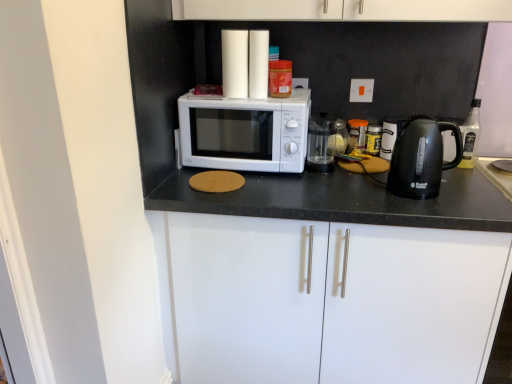
Question: Can you confirm if white matte microwave at center is shorter than white matte cabinet at center, which is the 1th cabinetry from bottom to top?

Choices:
 (A) yes
 (B) no

Answer: (A)

Question: Can you confirm if white matte microwave at center is smaller than white matte cabinet at center, which is the second cabinetry from top to bottom?

Choices:
 (A) yes
 (B) no

Answer: (A)

Question: Is white matte microwave at center positioned with its back to white matte cabinet at center, which is the second cabinetry from top to bottom?

Choices:
 (A) yes
 (B) no

Answer: (B)

Question: Considering the relative sizes of white matte microwave at center and white matte cabinet at center, which is the 1th cabinetry from bottom to top, in the image provided, is white matte microwave at center bigger than white matte cabinet at center, which is the 1th cabinetry from bottom to top,?

Choices:
 (A) yes
 (B) no

Answer: (B)

Question: Is white matte microwave at center positioned behind white matte cabinet at center, which is the 1th cabinetry from bottom to top?

Choices:
 (A) no
 (B) yes

Answer: (B)

Question: Visually, is white matte cabinet doors at upper center, positioned as the first cabinetry in top-to-bottom order, positioned to the left or to the right of black plastic bottle at right?

Choices:
 (A) left
 (B) right

Answer: (A)

Question: In the image, is white matte cabinet doors at upper center, positioned as the first cabinetry in top-to-bottom order, positioned in front of or behind black plastic bottle at right?

Choices:
 (A) front
 (B) behind

Answer: (A)

Question: In terms of width, does white matte cabinet doors at upper center, positioned as the first cabinetry in top-to-bottom order, look wider or thinner when compared to black plastic bottle at right?

Choices:
 (A) wide
 (B) thin

Answer: (A)

Question: Does point (476, 13) appear closer or farther from the camera than point (473, 137)?

Choices:
 (A) farther
 (B) closer

Answer: (B)

Question: From the image's perspective, is white matte cabinet at center, which is the 1th cabinetry from bottom to top, above or below transparent glass coffee maker at center?

Choices:
 (A) above
 (B) below

Answer: (B)

Question: Considering the positions of white matte cabinet at center, which is the 1th cabinetry from bottom to top, and transparent glass coffee maker at center in the image, is white matte cabinet at center, which is the 1th cabinetry from bottom to top, taller or shorter than transparent glass coffee maker at center?

Choices:
 (A) short
 (B) tall

Answer: (B)

Question: In terms of width, does white matte cabinet at center, which is the second cabinetry from top to bottom, look wider or thinner when compared to transparent glass coffee maker at center?

Choices:
 (A) wide
 (B) thin

Answer: (A)

Question: From a real-world perspective, relative to transparent glass coffee maker at center, is white matte cabinet at center, which is the 1th cabinetry from bottom to top, vertically above or below?

Choices:
 (A) above
 (B) below

Answer: (B)

Question: Would you say white matte cabinet at center, which is the second cabinetry from top to bottom, is to the left or to the right of white matte microwave at center in the picture?

Choices:
 (A) left
 (B) right

Answer: (B)

Question: In terms of size, does white matte cabinet at center, which is the 1th cabinetry from bottom to top, appear bigger or smaller than white matte microwave at center?

Choices:
 (A) small
 (B) big

Answer: (B)